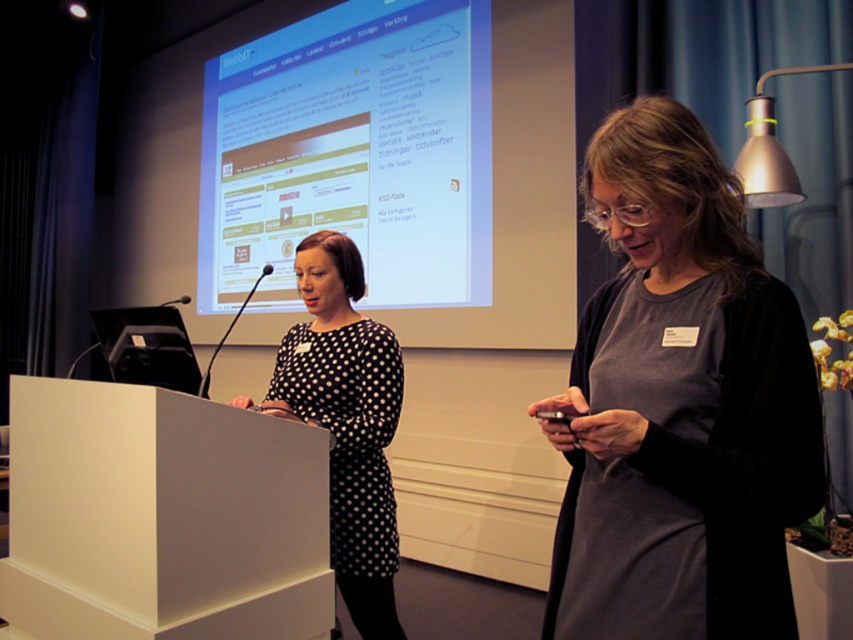
Question: Which of the following is the farthest from the observer?

Choices:
 (A) (416, 8)
 (B) (32, 548)
 (C) (305, 268)

Answer: (A)

Question: Which of the following is the farthest from the observer?

Choices:
 (A) black dotted dress at center
 (B) gray matte dress at right
 (C) white matte podium at lower left
 (D) white glossy projection screen at upper center

Answer: (D)

Question: Which point is closer to the camera taking this photo?

Choices:
 (A) (306, 61)
 (B) (386, 506)
 (C) (119, 403)

Answer: (C)

Question: Does gray matte dress at right appear on the right side of white matte podium at lower left?

Choices:
 (A) no
 (B) yes

Answer: (B)

Question: Does white glossy projection screen at upper center have a smaller size compared to black dotted dress at center?

Choices:
 (A) yes
 (B) no

Answer: (B)

Question: Is white glossy projection screen at upper center further to camera compared to black dotted dress at center?

Choices:
 (A) no
 (B) yes

Answer: (B)